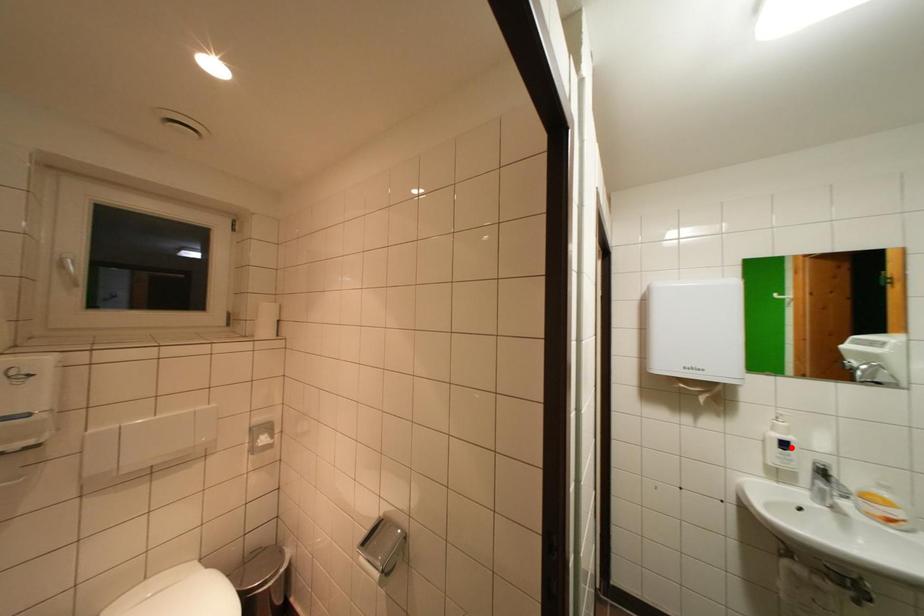
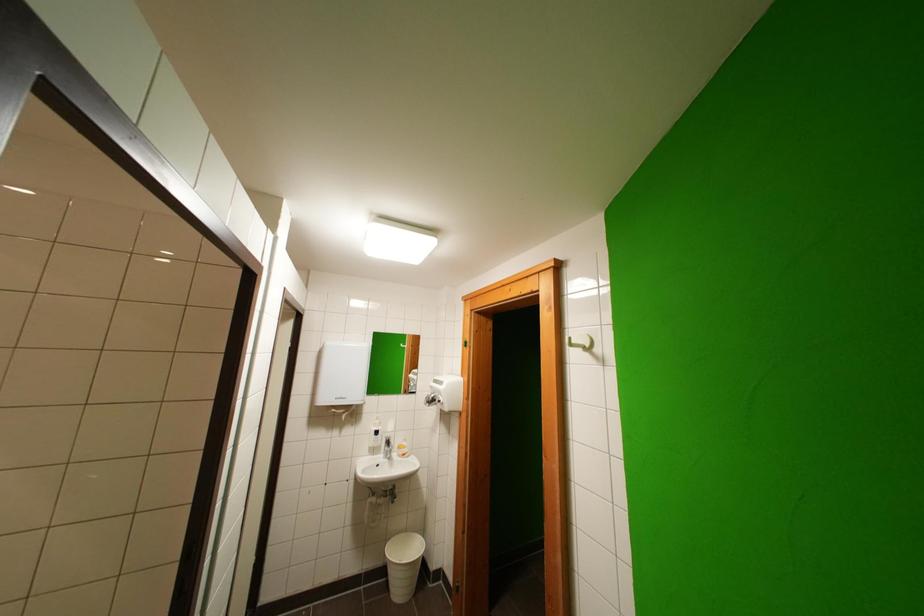
The point at the highlighted location is marked in the first image. Where is the corresponding point in the second image?

(383, 436)